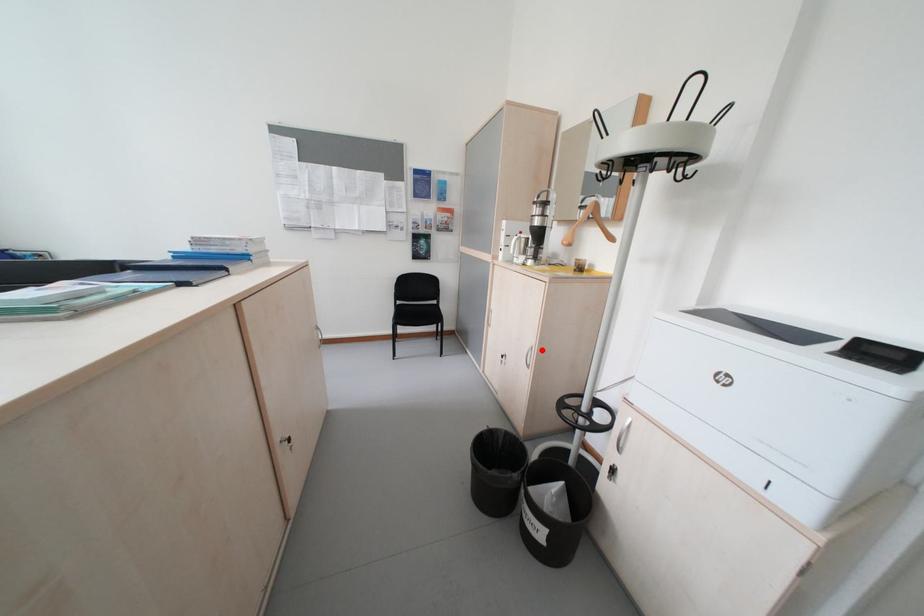
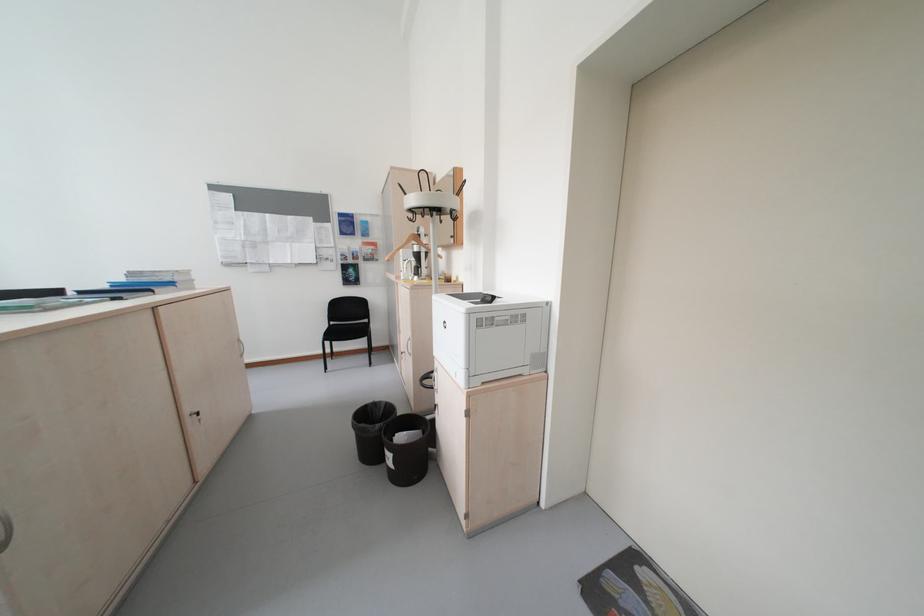
Find the pixel in the second image that matches the highlighted location in the first image.

(419, 341)